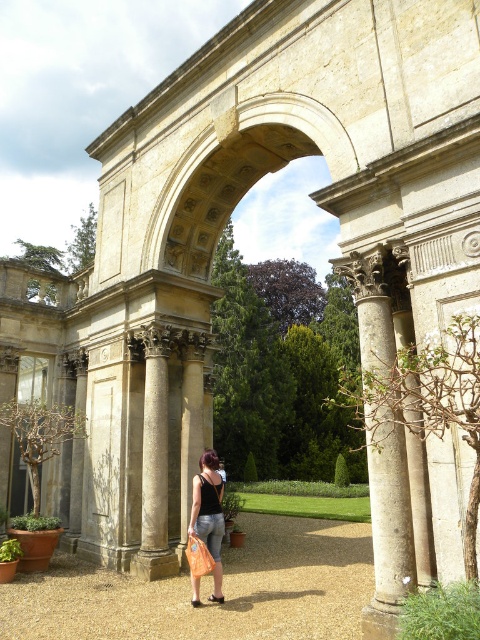
You are planning to take a photo of the smooth stone column at center and the black denim jeans at center in the classical archway scene. Which object should you focus on first if you want to capture both in a single frame without moving the camera?

You should focus on the smooth stone column at center first because it is larger than the black denim jeans at center, ensuring it is properly in focus before adjusting for the smaller object.

You are a photographer planning to capture a wide shot of the stone textured archway at center and the black denim jeans at center. Based on their sizes, which object should you focus on first to ensure both are in the frame?

The stone textured archway at center is wider than the black denim jeans at center, so you should focus on the stone textured archway at center first to ensure both fit in the frame.

You are standing in front of the classical structure and notice the stone textured archway at center and the black denim jeans at center. Which object is positioned higher relative to the other?

The stone textured archway at center is located above the black denim jeans at center, so it is positioned higher.